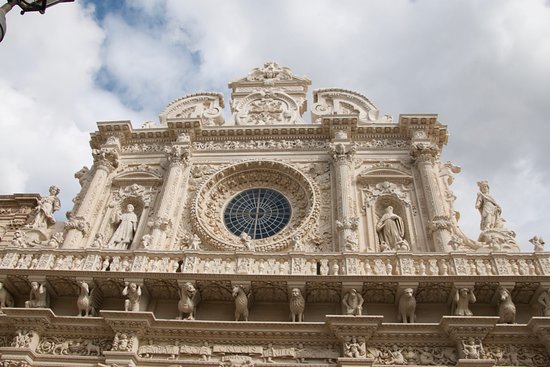
Identify the location of animal sculptures. (73, 295), (188, 299), (295, 301), (416, 303), (233, 305), (504, 304).